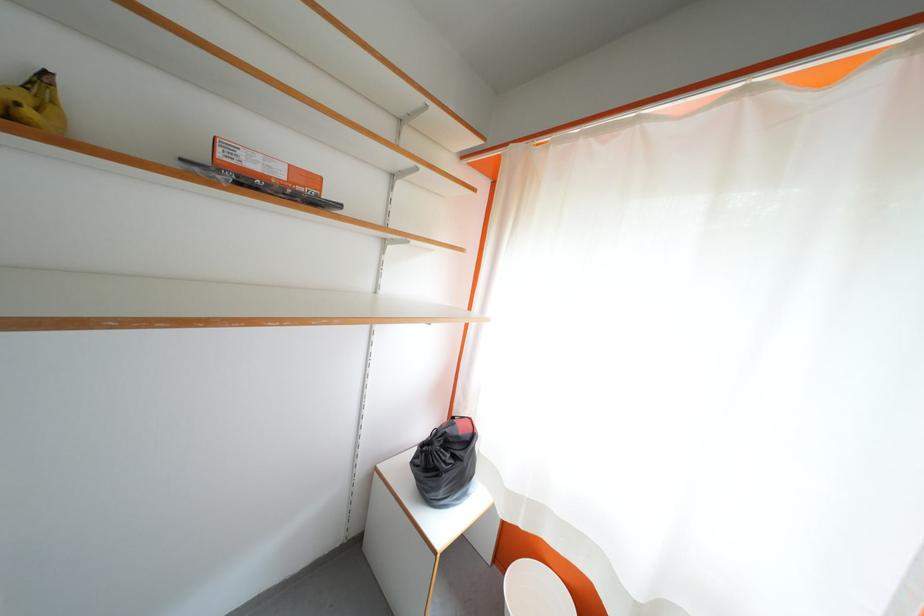
Find where to sit the chair sitting surface. Please return your answer as a coordinate pair (x, y).

(535, 591)